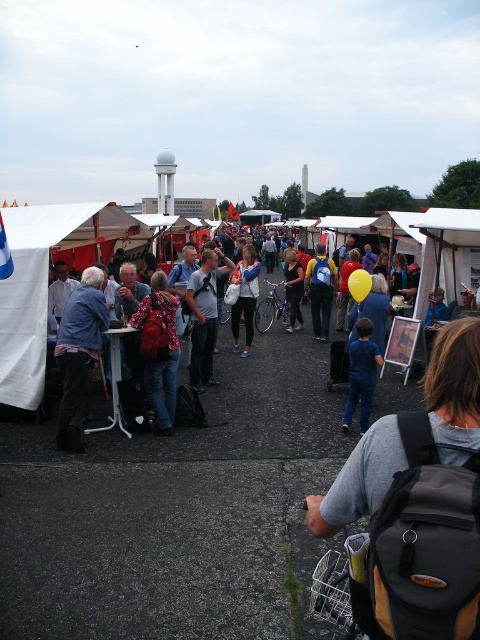
Is red floral backpack at center bigger than yellow rubber balloon at center?

Yes, red floral backpack at center is bigger than yellow rubber balloon at center.

Which of these two, red floral backpack at center or yellow rubber balloon at center, stands taller?

red floral backpack at center

Which is in front, point (169, 340) or point (350, 285)?

Point (169, 340) is more forward.

Locate an element on the screen. Image resolution: width=480 pixels, height=640 pixels. red floral backpack at center is located at coordinates (158, 349).

Is matte blue backpack at center thinner than yellow rubber balloon at center?

No, matte blue backpack at center is not thinner than yellow rubber balloon at center.

Is matte blue backpack at center wider than yellow rubber balloon at center?

Yes, matte blue backpack at center is wider than yellow rubber balloon at center.

Is point (300, 312) closer to viewer compared to point (367, 273)?

No, (300, 312) is further to viewer.

Where is `matte blue backpack at center`? The height and width of the screenshot is (640, 480). matte blue backpack at center is located at coordinates (292, 289).

Does point (208, 369) come farther from viewer compared to point (251, 333)?

No, (208, 369) is closer to viewer.

Looking at this image, between light blue denim jeans at center and white cotton shirt at center, which one appears on the left side from the viewer's perspective?

Positioned to the left is light blue denim jeans at center.

The image size is (480, 640). Identify the location of light blue denim jeans at center. (204, 316).